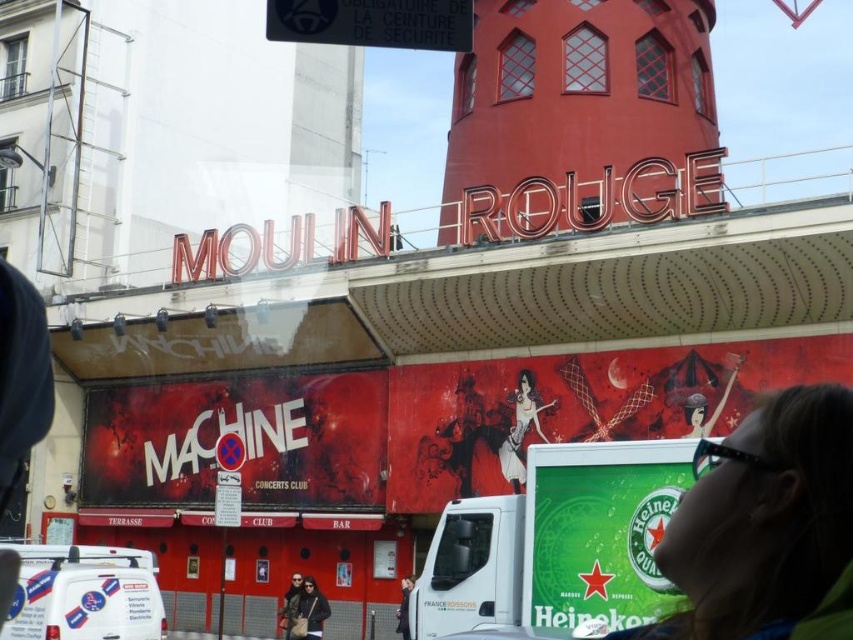
Question: Based on their relative distances, which object is nearer to the white plastic van at lower left?

Choices:
 (A) dark brown leather jacket at lower center
 (B) smooth skin figure at center
 (C) matte black jacket at lower center
 (D) matte black sunglasses at upper right

Answer: (C)

Question: Which point is farther to the camera?

Choices:
 (A) black plastic sign at upper center
 (B) white plastic van at lower left
 (C) matte black sunglasses at upper right
 (D) green matte heineken sign at lower right

Answer: (A)

Question: Can you confirm if green matte heineken sign at lower right is positioned above white plastic van at lower left?

Choices:
 (A) no
 (B) yes

Answer: (B)

Question: Is matte red tower at upper center wider than smooth skin figure at center?

Choices:
 (A) yes
 (B) no

Answer: (A)

Question: Which of the following is the closest to the observer?

Choices:
 (A) white plastic van at lower left
 (B) dark brown leather jacket at lower center

Answer: (A)

Question: Can you confirm if dark brown leather jacket at lower center is positioned to the left of dark gray jacket at lower center?

Choices:
 (A) no
 (B) yes

Answer: (B)